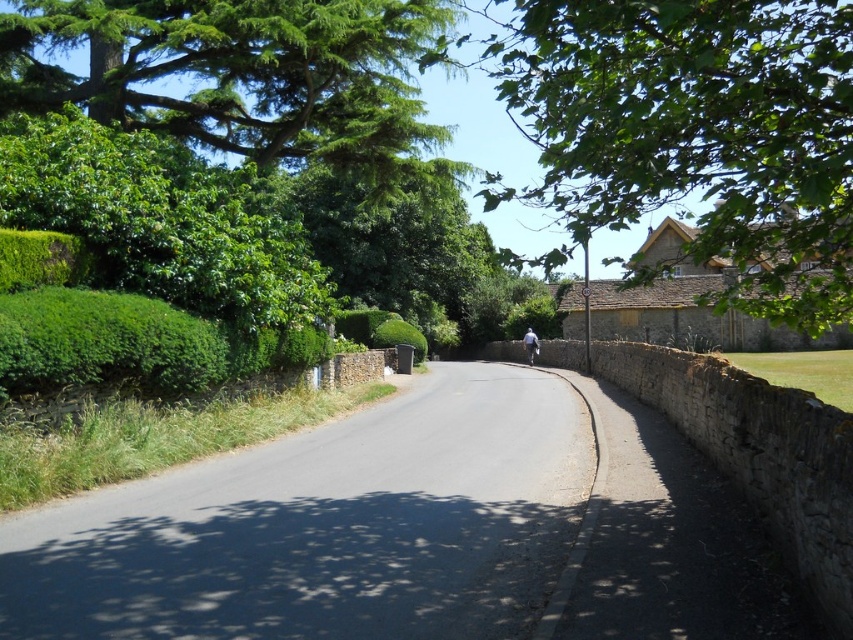
Question: Which of the following is the farthest from the observer?

Choices:
 (A) green leafy tree at upper left
 (B) light blue fabric at center

Answer: (B)

Question: Estimate the real-world distances between objects in this image. Which object is closer to the green leafy tree at upper right?

Choices:
 (A) light blue fabric at center
 (B) green leafy tree at upper left

Answer: (B)

Question: Is green leafy tree at upper left to the left of light blue fabric at center from the viewer's perspective?

Choices:
 (A) yes
 (B) no

Answer: (A)

Question: Based on their relative distances, which object is farther from the green leafy tree at upper right?

Choices:
 (A) green leafy tree at upper left
 (B) light blue fabric at center

Answer: (B)

Question: Can you confirm if green leafy tree at upper right is positioned above light blue fabric at center?

Choices:
 (A) no
 (B) yes

Answer: (B)

Question: Can you confirm if green leafy tree at upper right is wider than green leafy tree at upper left?

Choices:
 (A) yes
 (B) no

Answer: (A)